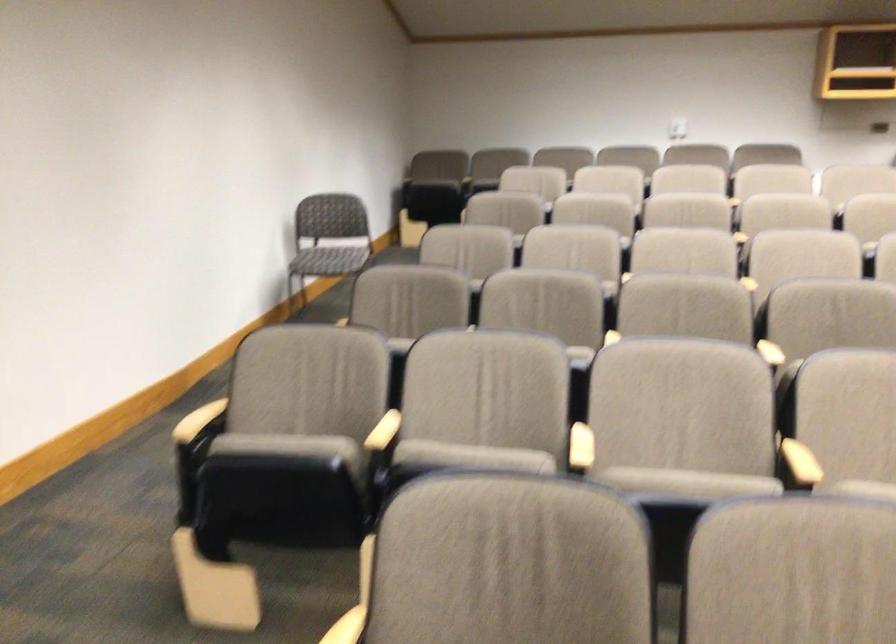
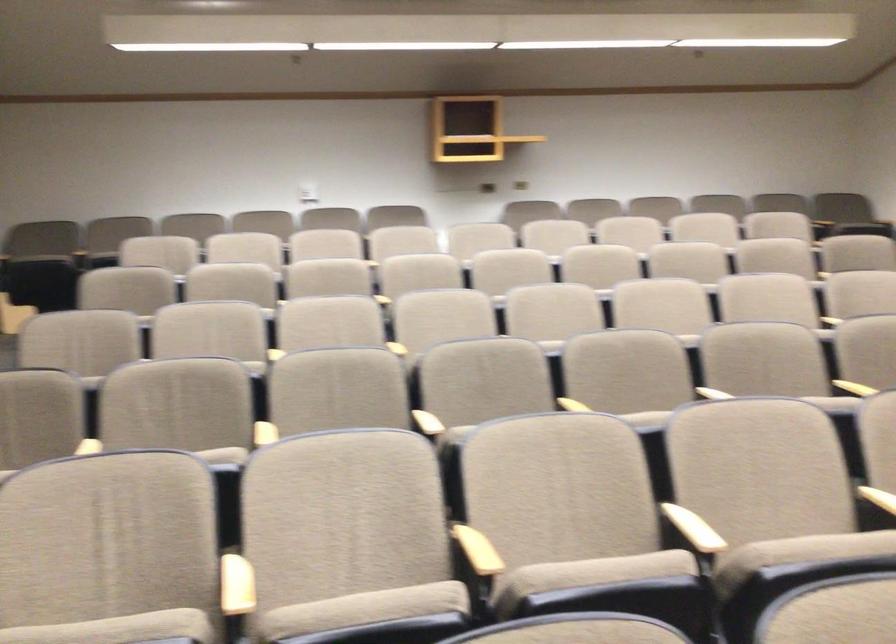
Find the pixel in the second image that matches point (806, 456) in the first image.

(478, 550)